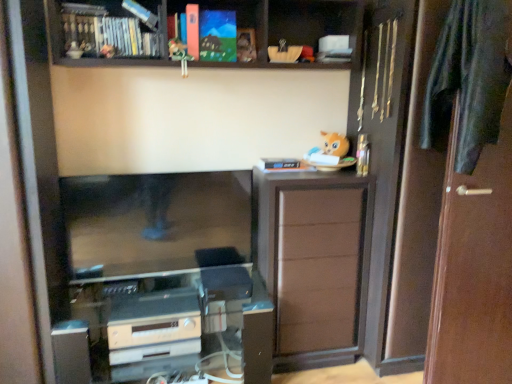
I want to click on blank space above satin silver appliance at lower center (from a real-world perspective), so click(x=162, y=311).